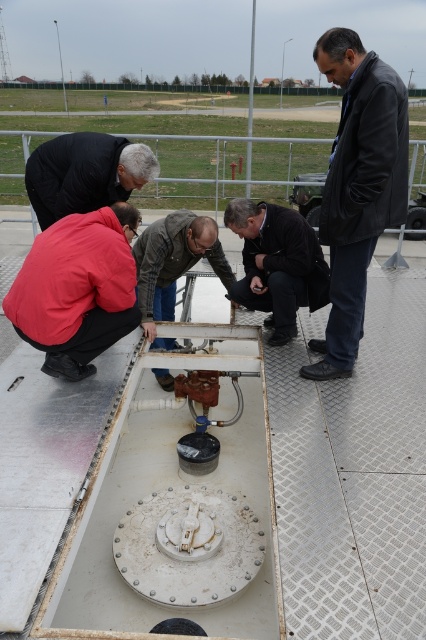
Question: Considering the relative positions of black leather jacket at center and brown leather jacket at center in the image provided, where is black leather jacket at center located with respect to brown leather jacket at center?

Choices:
 (A) left
 (B) right

Answer: (B)

Question: Which is farther from the black leather jacket at upper right?

Choices:
 (A) brown leather jacket at center
 (B) red matte jacket at lower left

Answer: (B)

Question: Can you confirm if black leather jacket at upper right is positioned to the right of red matte jacket at lower left?

Choices:
 (A) yes
 (B) no

Answer: (A)

Question: Which of these objects is positioned closest to the black matte jacket at center?

Choices:
 (A) black leather jacket at upper right
 (B) brown leather jacket at center

Answer: (B)

Question: Among these objects, which one is nearest to the camera?

Choices:
 (A) black matte jacket at center
 (B) red matte jacket at lower left

Answer: (B)

Question: Does black leather jacket at center appear under black matte jacket at center?

Choices:
 (A) no
 (B) yes

Answer: (B)